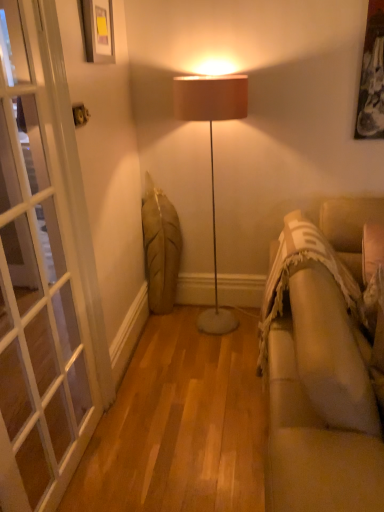
Question: Is beige fabric couch at right in front of or behind white glass screen door at left in the image?

Choices:
 (A) behind
 (B) front

Answer: (B)

Question: Is beige fabric couch at right wider or thinner than white glass screen door at left?

Choices:
 (A) thin
 (B) wide

Answer: (B)

Question: Which object is the closest to the beige fabric couch at right?

Choices:
 (A) white glass screen door at left
 (B) matte black picture frame at upper left

Answer: (A)

Question: Which object is positioned closest to the white glass screen door at left?

Choices:
 (A) beige fabric couch at right
 (B) matte black picture frame at upper left

Answer: (B)